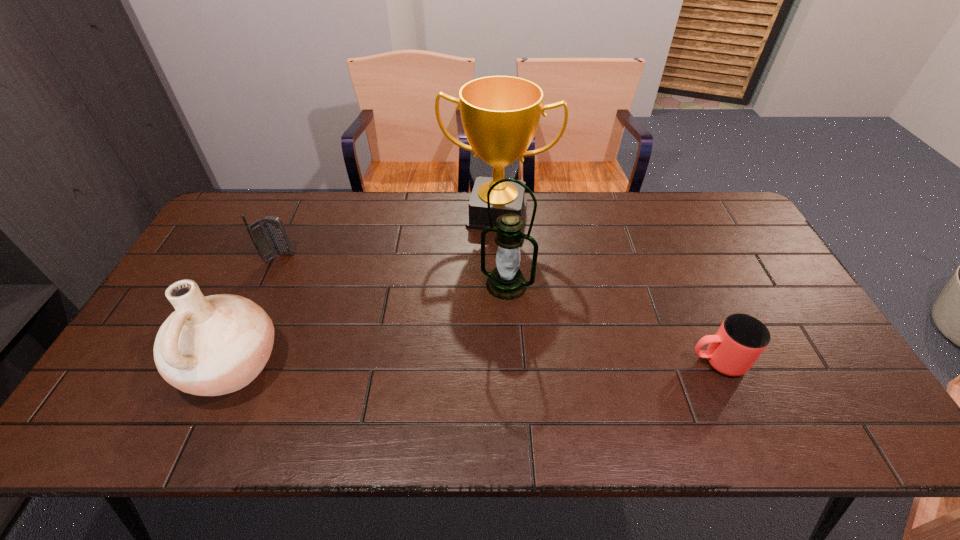
This screenshot has width=960, height=540. Find the location of `free space on the desktop that is between the pottery and the rightmost object and is positioned on the keyboard of the fourth tallest object`. free space on the desktop that is between the pottery and the rightmost object and is positioned on the keyboard of the fourth tallest object is located at coordinates pos(459,363).

Where is `vacant space on the desktop that is between the pottery and the rightmost object and is positioned on the side where the lantern emits light`? The width and height of the screenshot is (960, 540). vacant space on the desktop that is between the pottery and the rightmost object and is positioned on the side where the lantern emits light is located at coordinates (471, 363).

Where is `free spot on the desktop that is between the third shortest object and the rightmost object and is positioned on the front-facing side of the farthest object`? The width and height of the screenshot is (960, 540). free spot on the desktop that is between the third shortest object and the rightmost object and is positioned on the front-facing side of the farthest object is located at coordinates (464, 363).